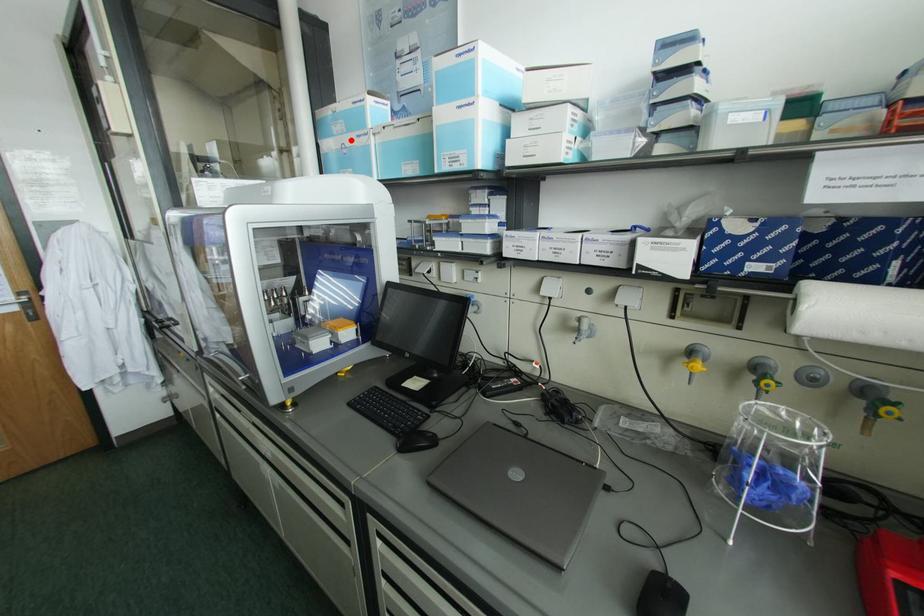
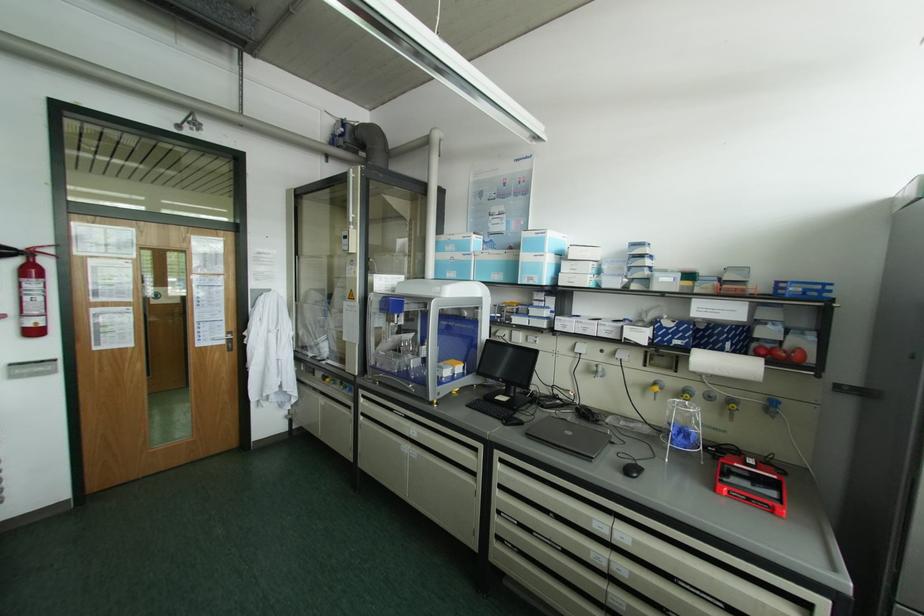
The point at the highlighted location is marked in the first image. Where is the corresponding point in the second image?

(457, 256)